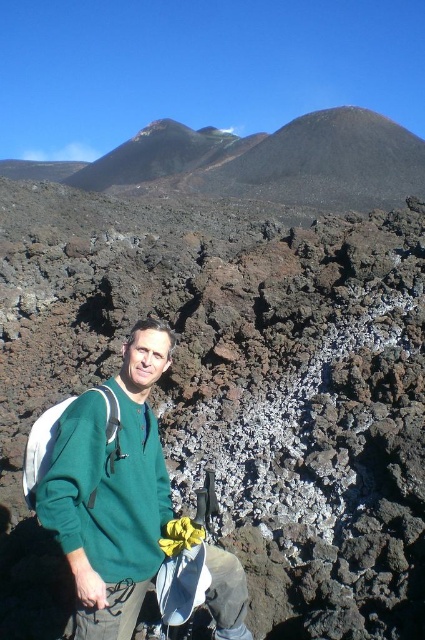
Question: Does green matte sweater at center appear under green fleece sweatshirt at center?

Choices:
 (A) no
 (B) yes

Answer: (A)

Question: Does green matte sweater at center have a lesser width compared to green fleece sweatshirt at center?

Choices:
 (A) yes
 (B) no

Answer: (B)

Question: Observing the image, what is the correct spatial positioning of green matte sweater at center in reference to green fleece sweatshirt at center?

Choices:
 (A) above
 (B) below

Answer: (A)

Question: Which object appears closest to the camera in this image?

Choices:
 (A) green matte sweater at center
 (B) green fleece sweatshirt at center

Answer: (B)

Question: Which of the following is the farthest from the observer?

Choices:
 (A) green fleece sweatshirt at center
 (B) green matte sweater at center

Answer: (B)